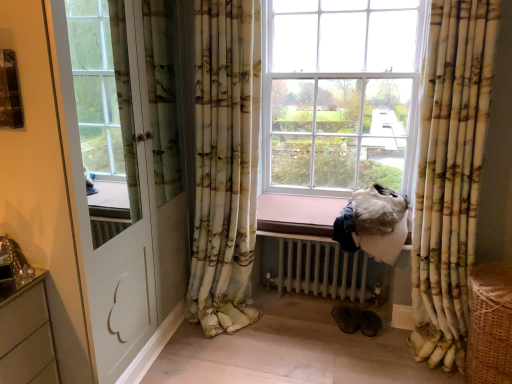
Question: Are floral fabric curtain at center, acting as the second curtain starting from the right, and white glossy door at left far apart?

Choices:
 (A) yes
 (B) no

Answer: (B)

Question: Is floral fabric curtain at center, acting as the second curtain starting from the right, oriented away from white glossy door at left?

Choices:
 (A) yes
 (B) no

Answer: (B)

Question: Can you confirm if floral fabric curtain at center, acting as the second curtain starting from the right, is smaller than white glossy door at left?

Choices:
 (A) yes
 (B) no

Answer: (A)

Question: Can you confirm if floral fabric curtain at center, arranged as the 1th curtain when viewed from the left, is bigger than white glossy door at left?

Choices:
 (A) yes
 (B) no

Answer: (B)

Question: From a real-world perspective, is floral fabric curtain at center, acting as the second curtain starting from the right, below white glossy door at left?

Choices:
 (A) yes
 (B) no

Answer: (A)

Question: Choose the correct answer: Is floral fabric curtain at right, which is counted as the 1th curtain, starting from the right, inside floral fabric curtain at center, arranged as the 1th curtain when viewed from the left, or outside it?

Choices:
 (A) inside
 (B) outside

Answer: (B)

Question: From the image's perspective, is floral fabric curtain at right, which is counted as the 1th curtain, starting from the right, located above or below floral fabric curtain at center, acting as the second curtain starting from the right?

Choices:
 (A) below
 (B) above

Answer: (A)

Question: Considering the positions of point (448, 203) and point (236, 158), is point (448, 203) closer or farther from the camera than point (236, 158)?

Choices:
 (A) closer
 (B) farther

Answer: (A)

Question: Considering their positions, is floral fabric curtain at right, which is counted as the 1th curtain, starting from the right, located in front of or behind floral fabric curtain at center, arranged as the 1th curtain when viewed from the left?

Choices:
 (A) behind
 (B) front

Answer: (B)

Question: Considering the positions of white painted metal radiator at lower center and floral fabric curtain at right, the second curtain in the left-to-right sequence, in the image, is white painted metal radiator at lower center taller or shorter than floral fabric curtain at right, the second curtain in the left-to-right sequence,?

Choices:
 (A) tall
 (B) short

Answer: (B)

Question: Visually, is white painted metal radiator at lower center positioned to the left or to the right of floral fabric curtain at right, which is counted as the 1th curtain, starting from the right?

Choices:
 (A) right
 (B) left

Answer: (B)

Question: Which is correct: white painted metal radiator at lower center is inside floral fabric curtain at right, which is counted as the 1th curtain, starting from the right, or outside of it?

Choices:
 (A) outside
 (B) inside

Answer: (A)

Question: From the image's perspective, relative to floral fabric curtain at right, which is counted as the 1th curtain, starting from the right, is white painted metal radiator at lower center above or below?

Choices:
 (A) above
 (B) below

Answer: (B)

Question: Is floral fabric curtain at center, acting as the second curtain starting from the right, bigger or smaller than white painted metal radiator at lower center?

Choices:
 (A) small
 (B) big

Answer: (B)

Question: Considering their positions, is floral fabric curtain at center, arranged as the 1th curtain when viewed from the left, located in front of or behind white painted metal radiator at lower center?

Choices:
 (A) behind
 (B) front

Answer: (B)